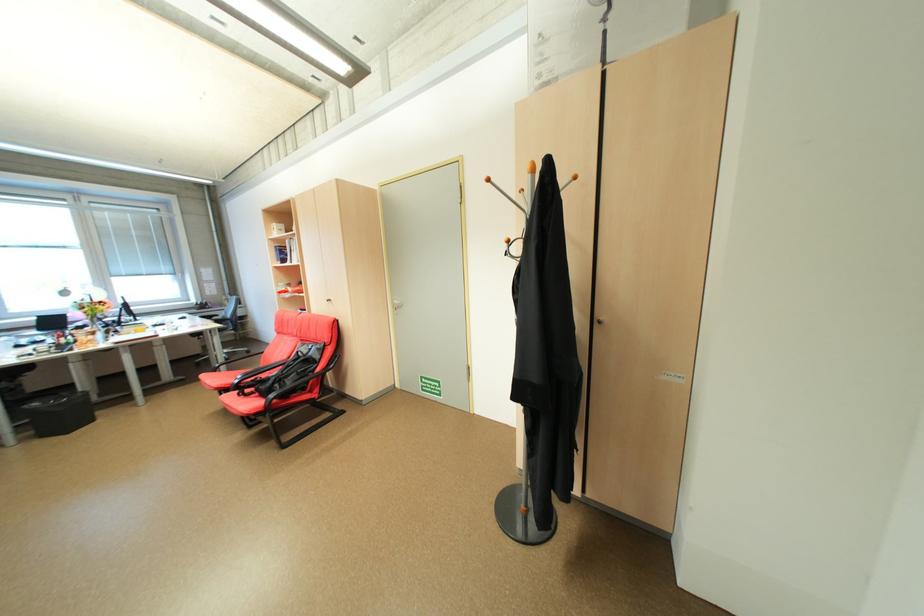
What do you see at coordinates (599, 321) in the screenshot? I see `the silver cabinet handle` at bounding box center [599, 321].